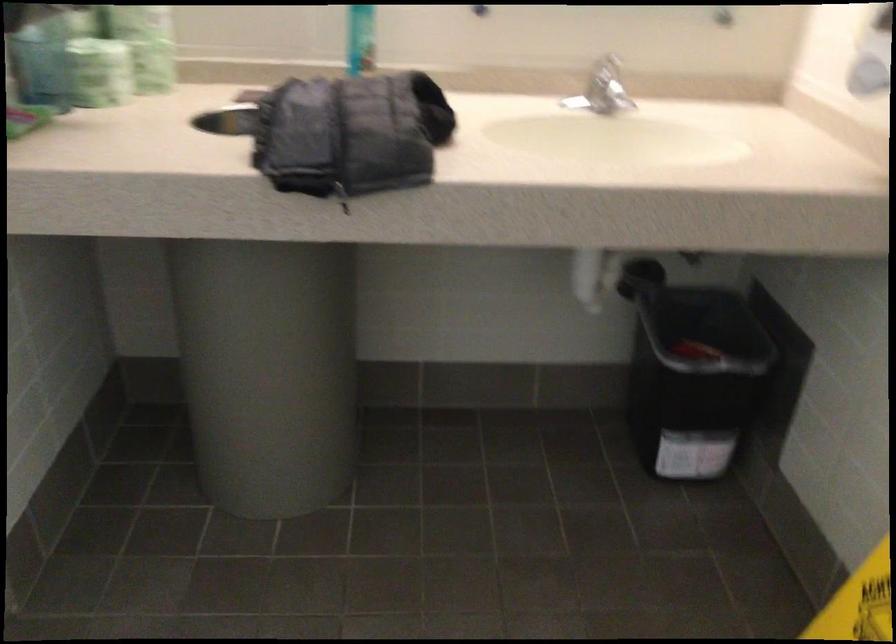
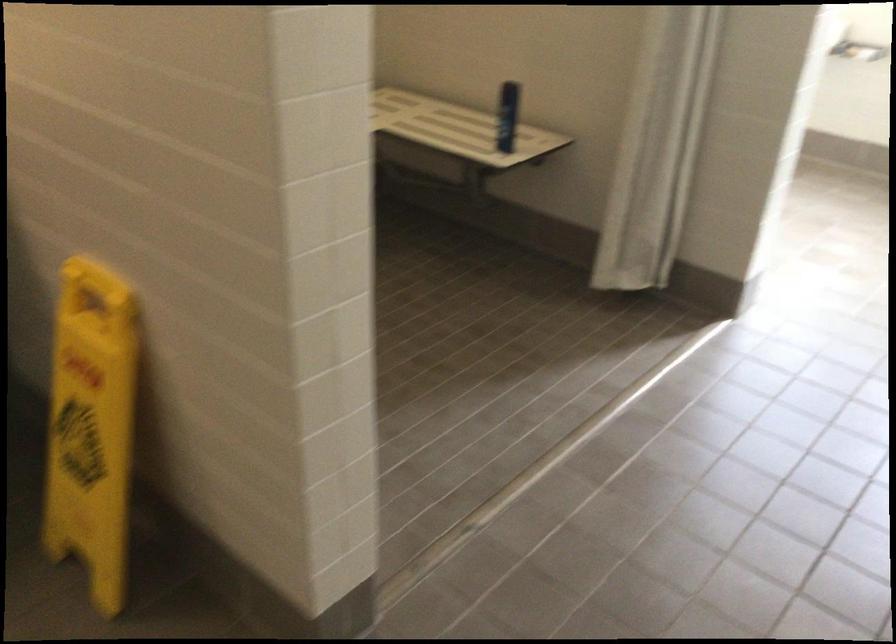
Question: The camera is either moving clockwise (left) or counter-clockwise (right) around the object. The first image is from the beginning of the video and the second image is from the end. Is the camera moving left or right when shooting the video?

Choices:
 (A) Left
 (B) Right

Answer: (A)